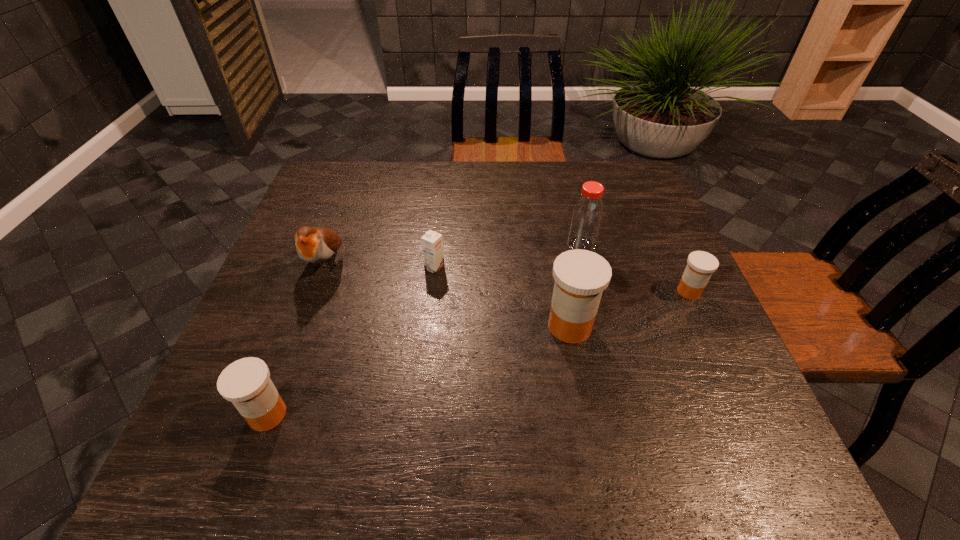
Where is `free space located on the label of the tallest medicine`? free space located on the label of the tallest medicine is located at coordinates (397, 326).

Locate an element on the screen. Image resolution: width=960 pixels, height=540 pixels. vacant area located 0.180m on the label of the tallest medicine is located at coordinates (462, 326).

In order to click on free space located 0.320m on the label of the shortest medicine in this screenshot , I will do `click(540, 292)`.

You are a GUI agent. You are given a task and a screenshot of the screen. Output one action in this format:
    pyautogui.click(x=<x>, y=<y>)
    Task: Click on the blank space located on the label of the shortest medicine
    Image resolution: width=960 pixels, height=540 pixels.
    Given the screenshot: What is the action you would take?
    pyautogui.click(x=577, y=292)

Where is `vacant space located 0.260m on the label of the shortest medicine`? vacant space located 0.260m on the label of the shortest medicine is located at coordinates point(564,292).

Image resolution: width=960 pixels, height=540 pixels. What are the coordinates of `free space located 0.310m on the back of the chocolate milk` in the screenshot? It's located at (443, 191).

Locate an element on the screen. vacant space located at the face of the bird is located at coordinates (300, 338).

Where is `free spot located 0.140m on the left of the bottle`? The image size is (960, 540). free spot located 0.140m on the left of the bottle is located at coordinates (514, 245).

The image size is (960, 540). I want to click on object that is at the near edge, so click(x=246, y=383).

Where is `medicine that is at the left edge`? medicine that is at the left edge is located at coordinates (246, 383).